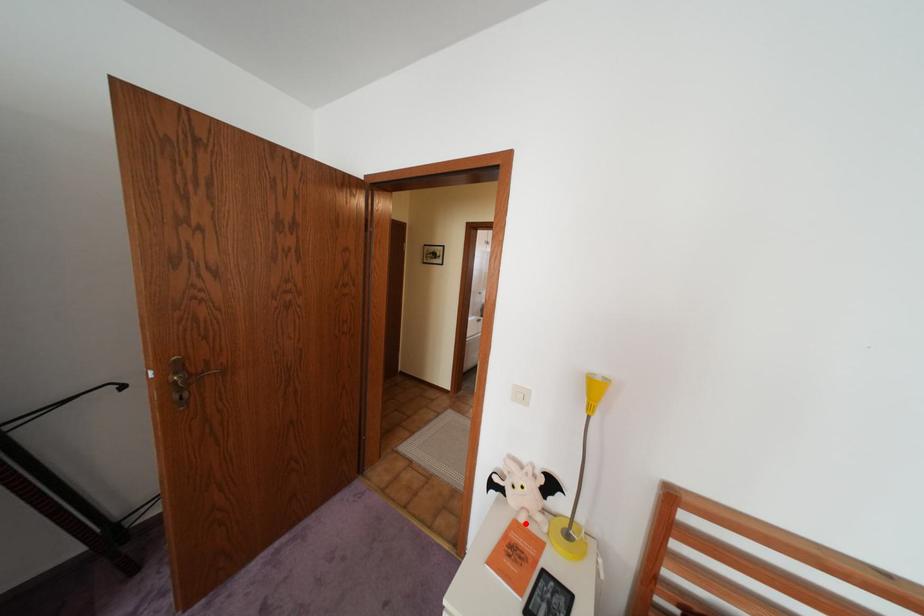
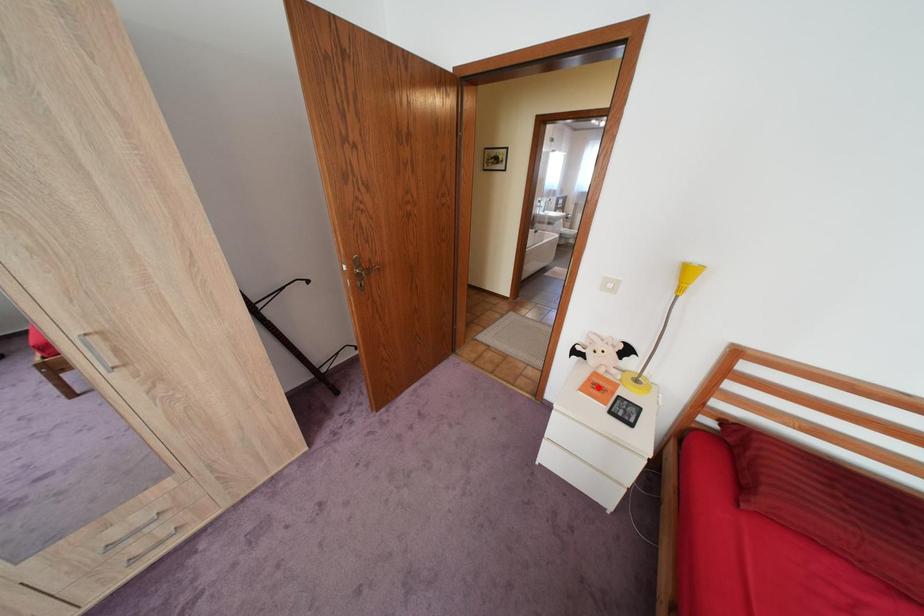
I am providing you with two images of the same scene from different viewpoints. A red point is marked on the first image and another point is marked on the second image. Do the highlighted points in image1 and image2 indicate the same real-world spot?

No